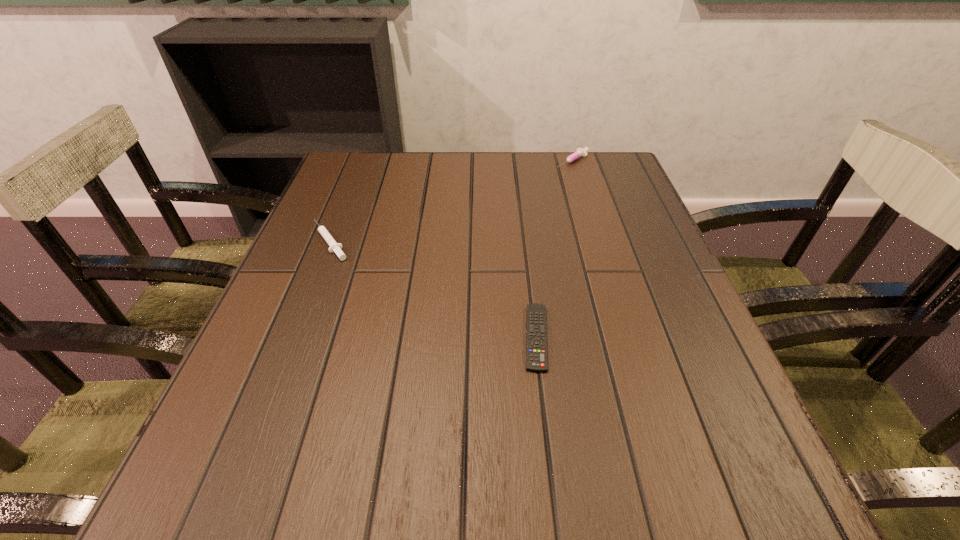
Identify the location of the tallest object. (580, 152).

In order to click on the farthest object in this screenshot , I will do `click(580, 152)`.

Locate an element on the screen. the left syringe is located at coordinates (335, 247).

Image resolution: width=960 pixels, height=540 pixels. I want to click on the nearer syringe, so click(335, 247).

The width and height of the screenshot is (960, 540). Find the location of `remote control`. remote control is located at coordinates (536, 333).

I want to click on the nearest object, so click(x=536, y=333).

This screenshot has height=540, width=960. I want to click on vacant space located on the front of the tallest object, so 588,211.

Find the location of a particular element. The image size is (960, 540). vacant space situated on the back of the shorter syringe is located at coordinates (348, 197).

Image resolution: width=960 pixels, height=540 pixels. In order to click on free space located on the front of the shortest object in this screenshot , I will do `click(557, 509)`.

Find the location of `object at the far edge`. object at the far edge is located at coordinates (580, 152).